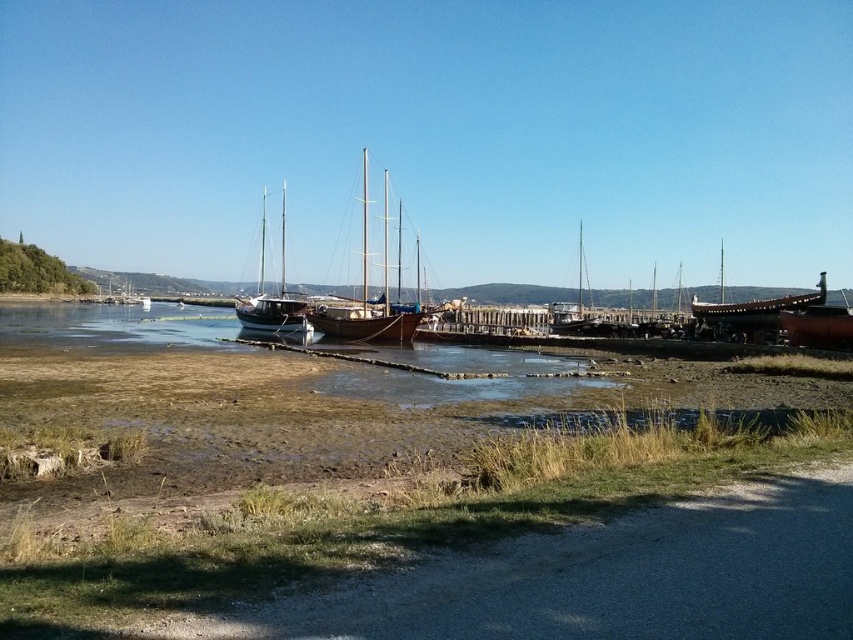
Measure the distance between brown wooden dock at lower center and camera.

brown wooden dock at lower center and camera are 20.23 meters apart.

How far apart are brown wooden dock at lower center and wooden ship at right?

A distance of 45.85 meters exists between brown wooden dock at lower center and wooden ship at right.

Identify the location of brown wooden dock at lower center. Image resolution: width=853 pixels, height=640 pixels. (456, 380).

How much distance is there between wooden ship at right and wooden boat at right?

wooden ship at right and wooden boat at right are 19.44 meters apart.

What do you see at coordinates (750, 316) in the screenshot? I see `wooden ship at right` at bounding box center [750, 316].

Where is `wooden ship at right`? wooden ship at right is located at coordinates (750, 316).

Between wooden sailboat at center and white wooden sailboat at center, which one has more height?

Standing taller between the two is wooden sailboat at center.

In order to click on wooden sailboat at center in this screenshot , I will do `click(367, 298)`.

This screenshot has height=640, width=853. What do you see at coordinates (367, 298) in the screenshot?
I see `wooden sailboat at center` at bounding box center [367, 298].

Find the location of a particular element. wooden sailboat at center is located at coordinates (367, 298).